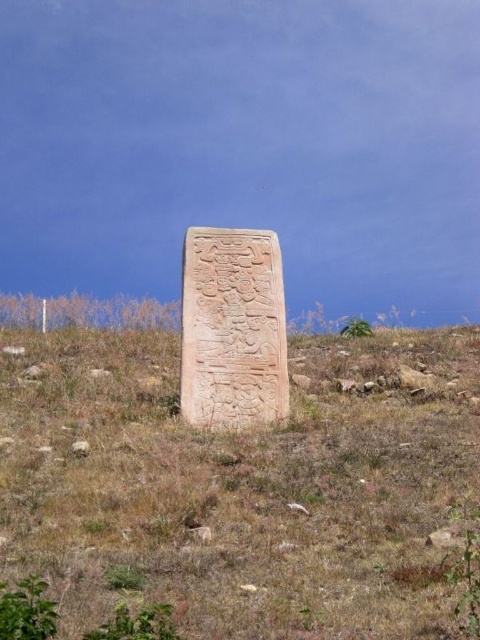
Which is in front, point (410, 458) or point (227, 346)?

Positioned in front is point (410, 458).

Which is more to the left, brown grassy at center or carved stone monument at center?

Positioned to the left is carved stone monument at center.

Does point (296, 584) come in front of point (224, 246)?

Yes.

I want to click on brown grassy at center, so click(242, 484).